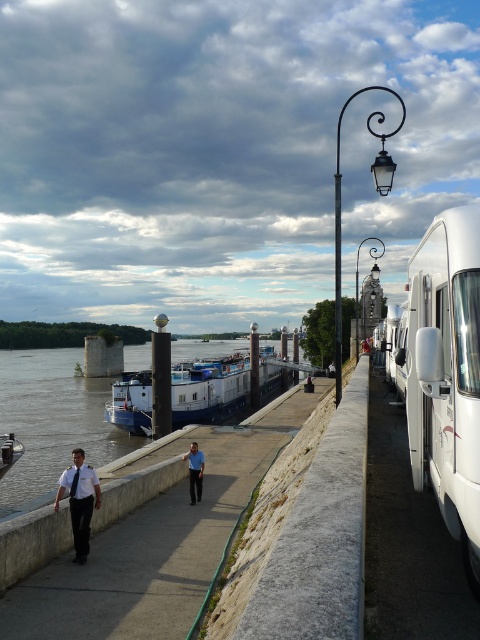
Question: Where is concrete sidewalk at center located in relation to blue shirt at center in the image?

Choices:
 (A) above
 (B) below

Answer: (B)

Question: Among these objects, which one is farthest from the camera?

Choices:
 (A) blue matte barge at center
 (B) white shirt and tie at center
 (C) light blue uniform at center

Answer: (A)

Question: Which point appears farthest from the camera in this image?

Choices:
 (A) (178, 614)
 (B) (190, 486)

Answer: (B)

Question: Considering the relative positions of concrete sidewalk at center and light blue uniform at center in the image provided, where is concrete sidewalk at center located with respect to light blue uniform at center?

Choices:
 (A) right
 (B) left

Answer: (A)

Question: Which of the following is the farthest from the observer?

Choices:
 (A) light blue uniform at center
 (B) concrete sidewalk at center
 (C) blue matte barge at center
 (D) white shirt and tie at center

Answer: (C)

Question: Is white glossy recreational vehicle at right bigger than blue shirt at center?

Choices:
 (A) yes
 (B) no

Answer: (A)